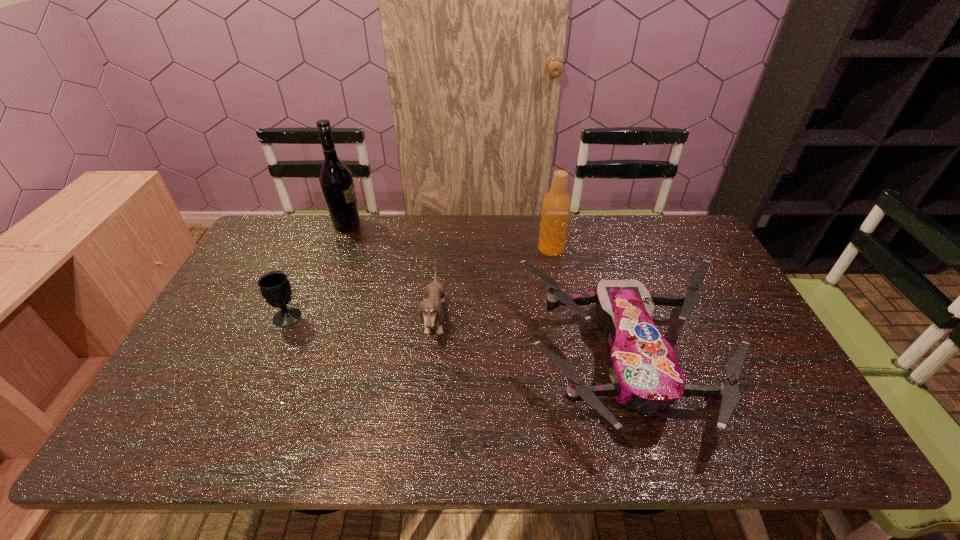
The image size is (960, 540). In order to click on blank space located 0.150m at the face of the third object from left to right in this screenshot , I will do click(499, 320).

Where is `wine bottle located at the far edge`? This screenshot has width=960, height=540. wine bottle located at the far edge is located at coordinates (336, 181).

This screenshot has height=540, width=960. Identify the location of beer bottle located at the far edge. (556, 207).

You are a GUI agent. You are given a task and a screenshot of the screen. Output one action in this format:
    pyautogui.click(x=<x>, y=<y>)
    Task: Click on the object that is at the near edge
    The image size is (960, 540).
    Given the screenshot: What is the action you would take?
    (x=645, y=374)

The height and width of the screenshot is (540, 960). What are the coordinates of `object that is at the right edge` in the screenshot? It's located at (645, 374).

This screenshot has width=960, height=540. In order to click on object that is positioned at the near right corner in this screenshot , I will do `click(645, 374)`.

Where is `vacant area at the far edge`? This screenshot has width=960, height=540. vacant area at the far edge is located at coordinates (323, 225).

In order to click on blank area at the near edge in this screenshot , I will do `click(383, 450)`.

At what (x,y) coordinates should I click in order to perform the action: click on vacant space at the left edge of the desktop. Please return your answer as a coordinate pair (x, y). The image size is (960, 540). Looking at the image, I should click on (228, 361).

Locate an element on the screen. The width and height of the screenshot is (960, 540). vacant space at the right edge is located at coordinates point(715,275).